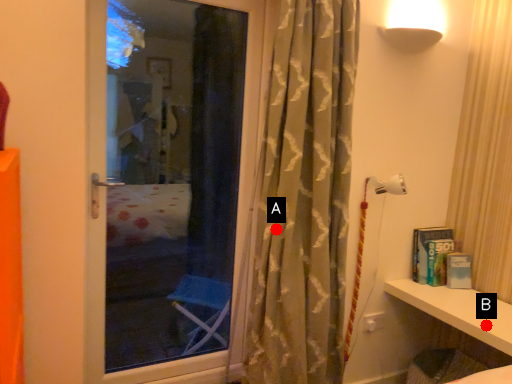
Question: Two points are circled on the image, labeled by A and B beside each circle. Which point is closer to the camera taking this photo?

Choices:
 (A) A is closer
 (B) B is closer

Answer: (A)